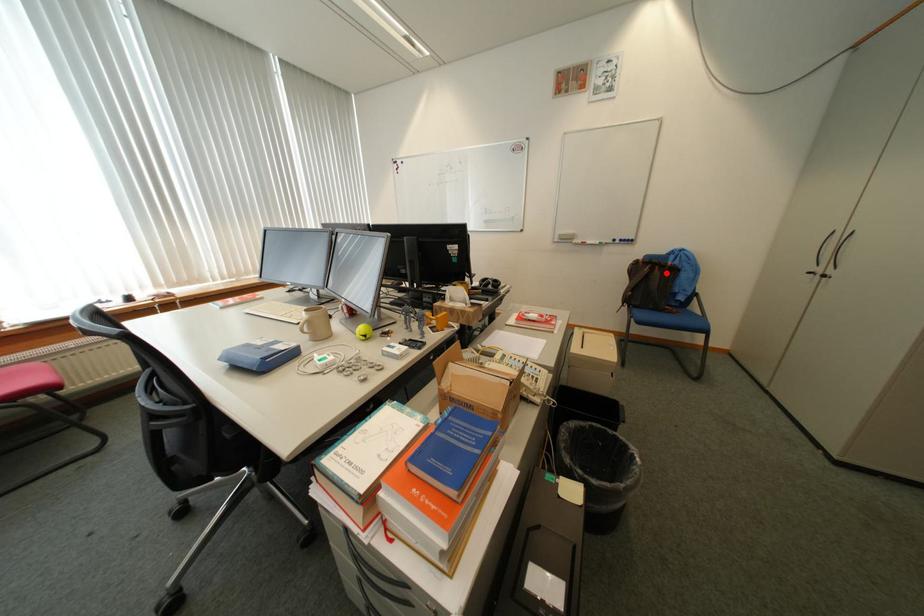
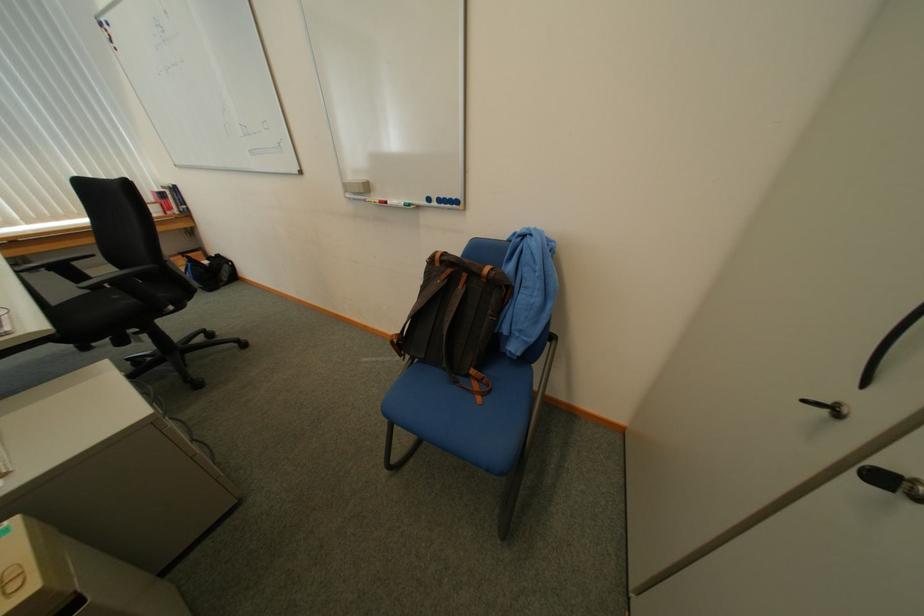
In the second image, find the point that corresponds to the highlighted location in the first image.

(469, 290)